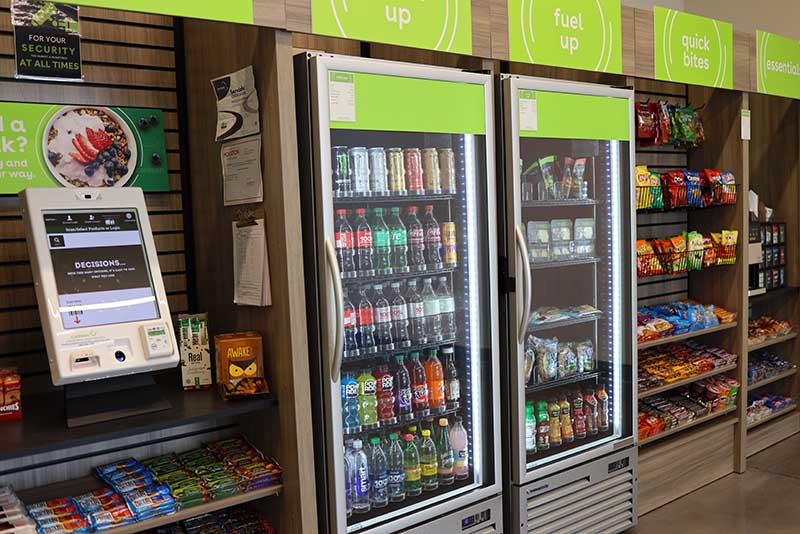
Locate an element on the screen. fridge handle is located at coordinates (534, 277), (337, 300).